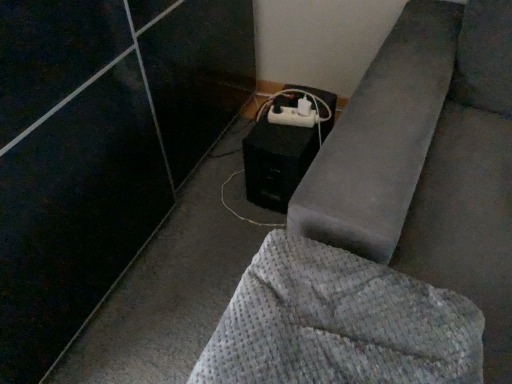
This screenshot has height=384, width=512. Identify the location of vacant area situated to the left side of black matte speaker at lower center. (216, 188).